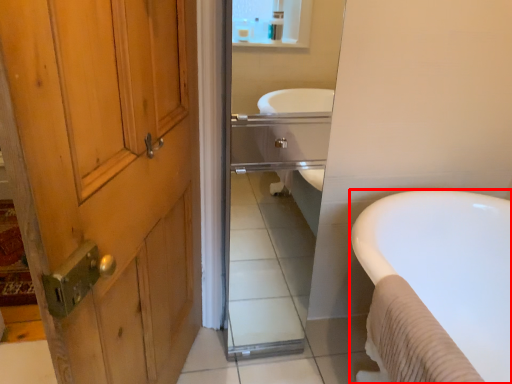
Question: Where is bathtub (annotated by the red box) located in relation to mirror in the image?

Choices:
 (A) left
 (B) right

Answer: (B)